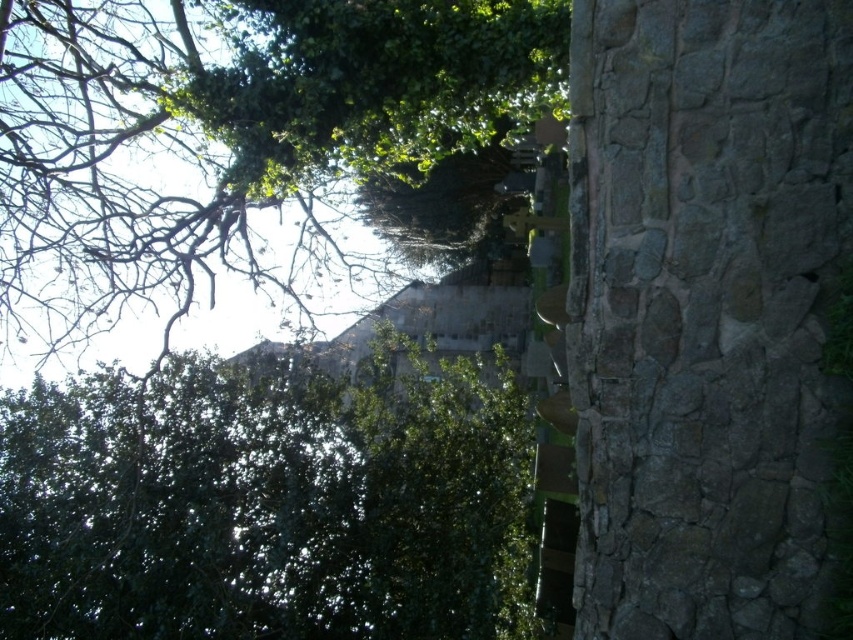
How far apart are gray stone wall at right and green leafy tree at upper left?

They are 5.21 meters apart.

Does gray stone wall at right have a lesser height compared to green leafy tree at upper left?

No.

Who is more distant from viewer, (688, 632) or (155, 394)?

The point (155, 394) is behind.

The width and height of the screenshot is (853, 640). What are the coordinates of `gray stone wall at right` in the screenshot? It's located at (704, 308).

Does gray stone wall at right have a larger size compared to green leafy tree at upper center?

Correct, gray stone wall at right is larger in size than green leafy tree at upper center.

Which is more to the left, gray stone wall at right or green leafy tree at upper center?

green leafy tree at upper center is more to the left.

Measure the distance between point (585, 186) and camera.

The distance of point (585, 186) from camera is 14.81 feet.

Where is `gray stone wall at right`? This screenshot has height=640, width=853. gray stone wall at right is located at coordinates (704, 308).

Who is positioned more to the left, green leafy tree at upper left or green leafy tree at upper center?

green leafy tree at upper left

Is green leafy tree at upper left positioned behind green leafy tree at upper center?

Yes, green leafy tree at upper left is behind green leafy tree at upper center.

What do you see at coordinates (268, 502) in the screenshot?
I see `green leafy tree at upper left` at bounding box center [268, 502].

Locate an element on the screen. The height and width of the screenshot is (640, 853). green leafy tree at upper left is located at coordinates (268, 502).